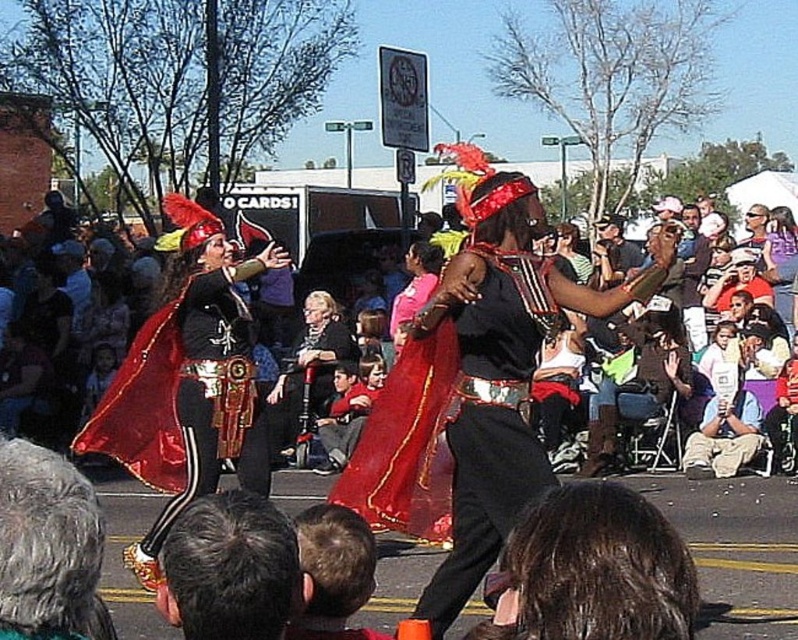
Can you confirm if shiny black dress at center is positioned to the right of dark brown hair at lower center?

Indeed, shiny black dress at center is positioned on the right side of dark brown hair at lower center.

Which is below, shiny black dress at center or dark brown hair at lower center?

dark brown hair at lower center is lower down.

Who is more forward, [469,506] or [352,596]?

Positioned in front is point [352,596].

Locate an element on the screen. This screenshot has height=640, width=798. shiny black dress at center is located at coordinates (488, 442).

Does point (157, 404) lie in front of point (160, 593)?

No, it is behind (160, 593).

What do you see at coordinates (182, 403) in the screenshot? I see `shiny red cape at left` at bounding box center [182, 403].

Identify the location of shiny red cape at left. The image size is (798, 640). (182, 403).

Find the location of a particular element. The height and width of the screenshot is (640, 798). shiny red cape at left is located at coordinates (182, 403).

Who is taller, shiny red cape at left or shiny black dress at center?

shiny red cape at left is taller.

Is point (176, 456) more distant than point (471, 332)?

That is True.

Between point (172, 461) and point (532, 340), which one is positioned in front?

Point (532, 340)

Where is `shiny red cape at left`? This screenshot has height=640, width=798. shiny red cape at left is located at coordinates (182, 403).